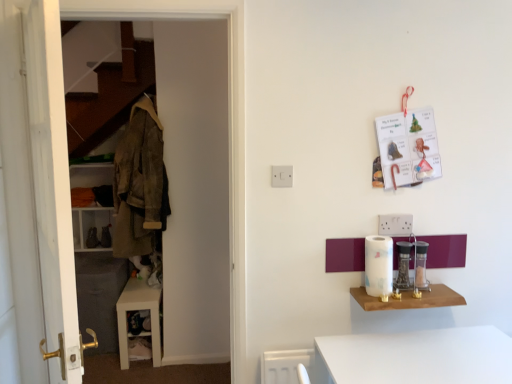
Question: From the image's perspective, is white glossy cabinet at lower left below brown corduroy jacket at left?

Choices:
 (A) yes
 (B) no

Answer: (A)

Question: Does white glossy cabinet at lower left have a greater height compared to brown corduroy jacket at left?

Choices:
 (A) no
 (B) yes

Answer: (A)

Question: Can you confirm if white glossy cabinet at lower left is positioned to the right of brown corduroy jacket at left?

Choices:
 (A) yes
 (B) no

Answer: (B)

Question: Is white glossy cabinet at lower left far from brown corduroy jacket at left?

Choices:
 (A) no
 (B) yes

Answer: (A)

Question: Can you confirm if white glossy cabinet at lower left is thinner than brown corduroy jacket at left?

Choices:
 (A) no
 (B) yes

Answer: (B)

Question: From the image's perspective, is white glossy cabinet at lower left on top of brown corduroy jacket at left?

Choices:
 (A) yes
 (B) no

Answer: (B)

Question: Considering the relative sizes of brown corduroy jacket at left and white glossy paper towel holder at right, which is the second appliance in left-to-right order, in the image provided, is brown corduroy jacket at left bigger than white glossy paper towel holder at right, which is the second appliance in left-to-right order,?

Choices:
 (A) no
 (B) yes

Answer: (B)

Question: Can you confirm if brown corduroy jacket at left is shorter than white glossy paper towel holder at right, which is the second appliance in left-to-right order?

Choices:
 (A) no
 (B) yes

Answer: (A)

Question: From the image's perspective, would you say brown corduroy jacket at left is shown under white glossy paper towel holder at right, which appears as the second appliance when viewed from the right?

Choices:
 (A) no
 (B) yes

Answer: (A)

Question: Is white glossy paper towel holder at right, which is the second appliance in left-to-right order, inside brown corduroy jacket at left?

Choices:
 (A) yes
 (B) no

Answer: (B)

Question: Does brown corduroy jacket at left have a greater height compared to white glossy paper towel holder at right, which is the second appliance in left-to-right order?

Choices:
 (A) yes
 (B) no

Answer: (A)

Question: From the image's perspective, does brown corduroy jacket at left appear higher than white glossy paper towel holder at right, which appears as the second appliance when viewed from the right?

Choices:
 (A) no
 (B) yes

Answer: (B)

Question: Is white wooden dresser at left located outside clear glass jar at right, the first appliance from the right?

Choices:
 (A) yes
 (B) no

Answer: (A)